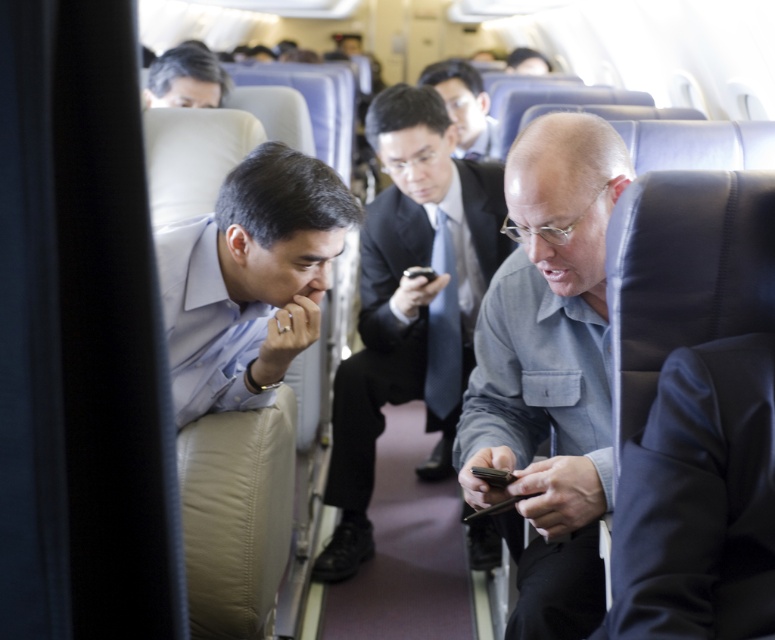
You are seated in the airplane cabin and notice two men in the foreground. One is wearing a light blue shirt at center and the other a gray fabric shirt at center. Which of these two shirts is located to the right of the other?

The gray fabric shirt at center is positioned on the right side of light blue shirt at center.

You are seated in the airplane cabin and notice two passengers in the foreground. One is wearing a light blue shirt, and the other has a gray fabric shirt at center. Which passenger is sitting closer to the aisle based on their positions?

The gray fabric shirt at center is located at point (548, 371), which is closer to the aisle compared to the man in the light blue shirt on the left.

From the picture: You are a flight attendant passing through the aisle and need to hand a snack to the passenger with the gray fabric shirt at center. Since there is limited space between the seats, can you reach them without moving the matte black suit at center?

The gray fabric shirt at center is positioned under matte black suit at center, so you can reach them without moving the matte black suit at center as they are in different vertical positions.